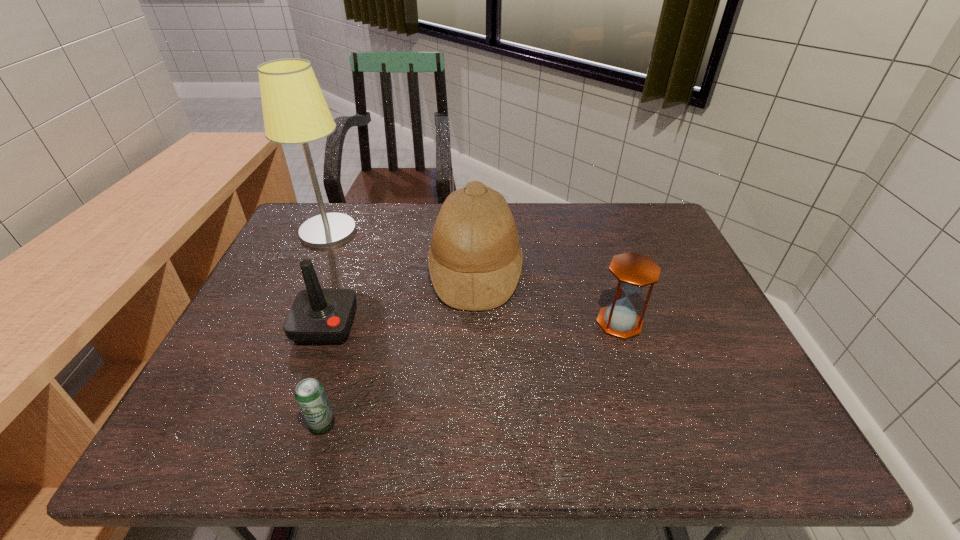
I want to click on the tallest object, so click(x=295, y=111).

Find the location of a particular element. This screenshot has width=960, height=540. the fourth shortest object is located at coordinates (475, 260).

You are a GUI agent. You are given a task and a screenshot of the screen. Output one action in this format:
    pyautogui.click(x=<x>, y=<y>)
    Task: Click on the hat
    
    Given the screenshot: What is the action you would take?
    pyautogui.click(x=475, y=260)

Where is `joystick`? joystick is located at coordinates (318, 316).

What are the coordinates of `the rightmost object` in the screenshot? It's located at (633, 272).

Where is `the shortest object`? the shortest object is located at coordinates (310, 395).

Locate an element on the screen. beer can is located at coordinates (310, 395).

At what (x,y) coordinates should I click in order to perform the action: click on vacant space located on the front of the tallest object. Please return your answer as a coordinate pair (x, y). This screenshot has width=960, height=540. Looking at the image, I should click on (281, 337).

The height and width of the screenshot is (540, 960). In order to click on vacant space located 0.140m on the front-facing side of the second object from right to left in this screenshot , I will do coord(572,271).

This screenshot has width=960, height=540. In order to click on vacant space located on the back of the joystick in this screenshot , I will do click(348, 265).